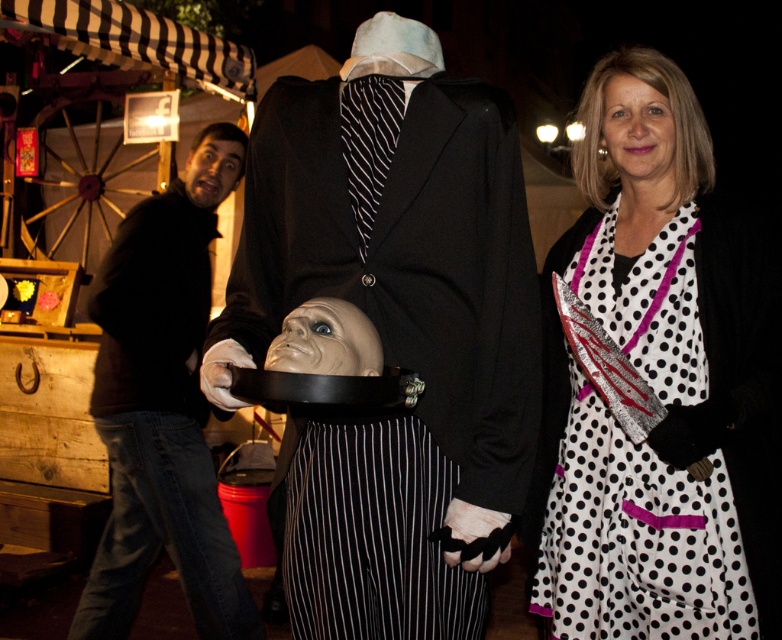
You are a photographer trying to capture a closeup of both the white dotted dress at center and the smooth skin face at upper left in the scene. Given that your camera can only focus on objects within a 2 meter range, will you be able to capture both subjects in one shot?

The white dotted dress at center and smooth skin face at upper left are 1.98 meters apart, so yes, the camera can focus on both subjects as they are within the 2 meter range.